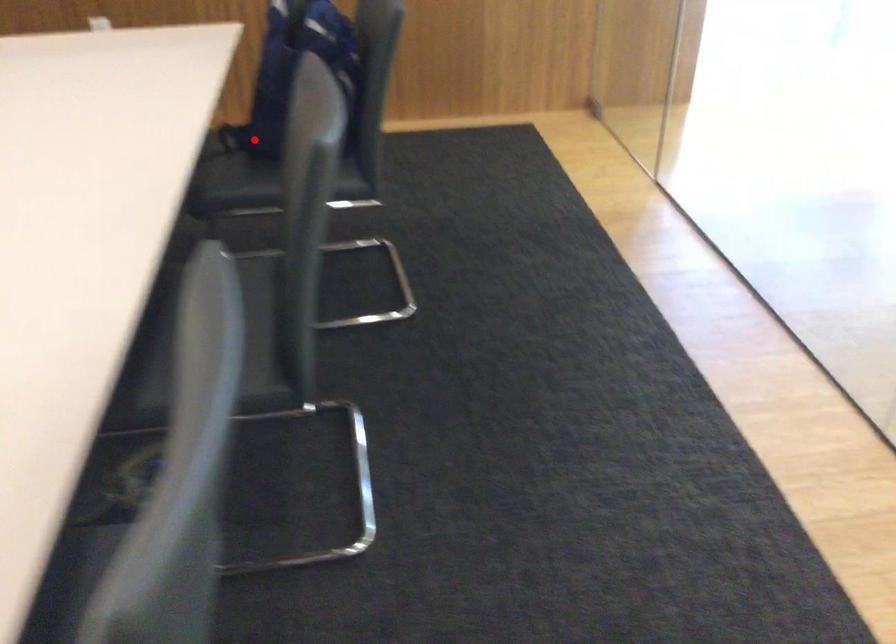
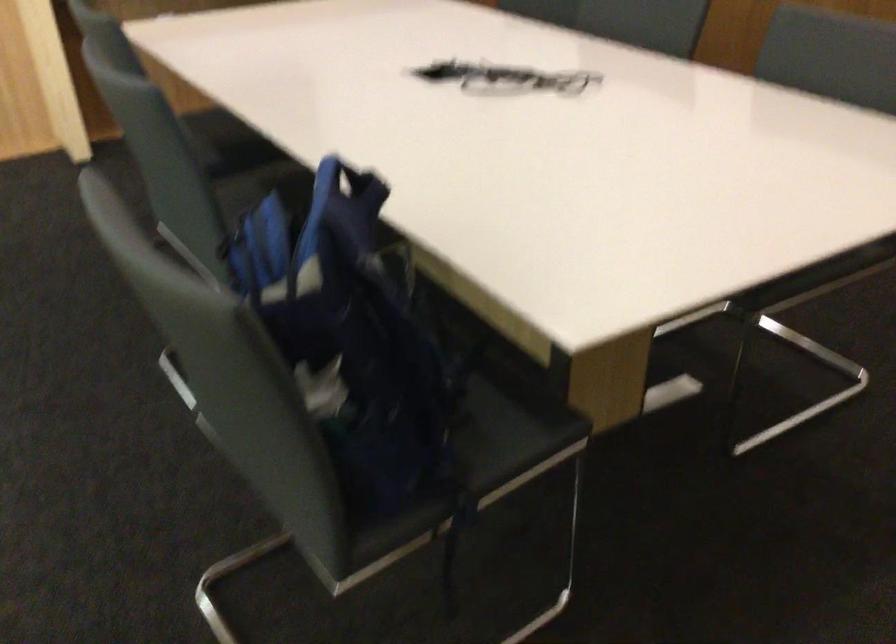
Question: A red point is marked in image1. In image2, is the corresponding 3D point closer to the camera or farther? Reply with the corresponding letter.

Choices:
 (A) The corresponding 3D point is closer.
 (B) The corresponding 3D point is farther.

Answer: (A)